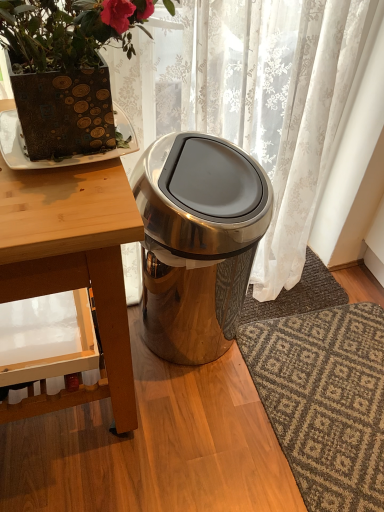
This screenshot has height=512, width=384. I want to click on vacant area located to the right-hand side of satin silver trash can at center, so click(x=290, y=349).